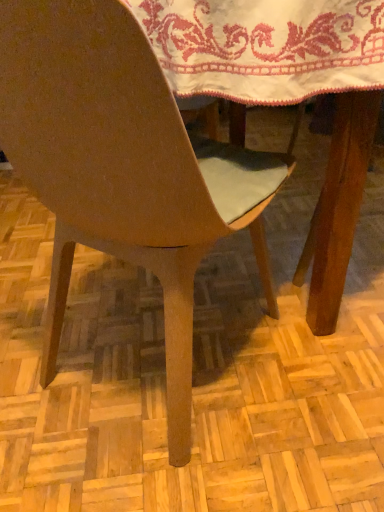
Question: Is white embroidered cloth at upper center closer to camera compared to matte wood chair at center?

Choices:
 (A) no
 (B) yes

Answer: (A)

Question: Are white embroidered cloth at upper center and matte wood chair at center located far from each other?

Choices:
 (A) yes
 (B) no

Answer: (B)

Question: Is white embroidered cloth at upper center at the right side of matte wood chair at center?

Choices:
 (A) no
 (B) yes

Answer: (B)

Question: Is white embroidered cloth at upper center shorter than matte wood chair at center?

Choices:
 (A) yes
 (B) no

Answer: (A)

Question: Does white embroidered cloth at upper center have a larger size compared to matte wood chair at center?

Choices:
 (A) no
 (B) yes

Answer: (A)

Question: Considering the relative sizes of white embroidered cloth at upper center and matte wood chair at center in the image provided, is white embroidered cloth at upper center thinner than matte wood chair at center?

Choices:
 (A) yes
 (B) no

Answer: (B)

Question: From a real-world perspective, does matte wood chair at center stand above white embroidered cloth at upper center?

Choices:
 (A) no
 (B) yes

Answer: (A)

Question: Is matte wood chair at center aimed at white embroidered cloth at upper center?

Choices:
 (A) yes
 (B) no

Answer: (A)

Question: Is matte wood chair at center bigger than white embroidered cloth at upper center?

Choices:
 (A) no
 (B) yes

Answer: (B)

Question: Does matte wood chair at center appear on the right side of white embroidered cloth at upper center?

Choices:
 (A) yes
 (B) no

Answer: (B)

Question: Is matte wood chair at center positioned with its back to white embroidered cloth at upper center?

Choices:
 (A) yes
 (B) no

Answer: (B)

Question: Is matte wood chair at center thinner than white embroidered cloth at upper center?

Choices:
 (A) yes
 (B) no

Answer: (A)

Question: Considering the positions of white embroidered cloth at upper center and matte wood chair at center in the image, is white embroidered cloth at upper center wider or thinner than matte wood chair at center?

Choices:
 (A) wide
 (B) thin

Answer: (A)